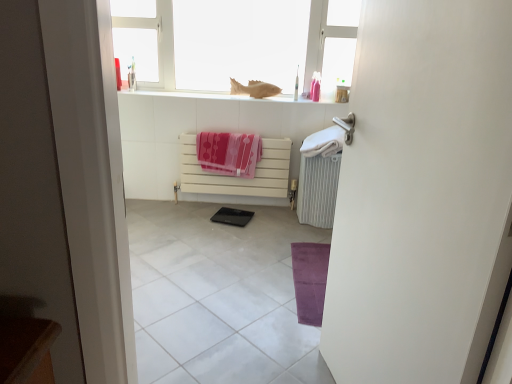
The image size is (512, 384). Identify the location of free area in between black glossy pad at center and white metallic radiator at right. (272, 215).